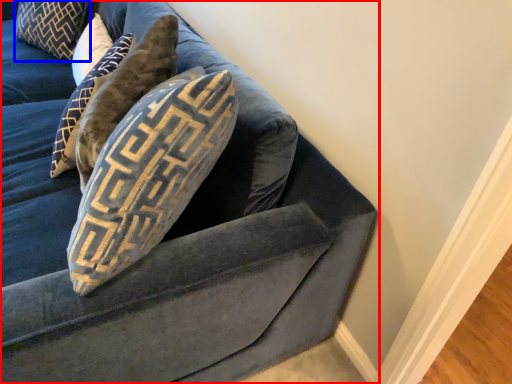
Question: Which object appears farthest to the camera in this image, studio couch (highlighted by a red box) or pillow (highlighted by a blue box)?

Choices:
 (A) studio couch
 (B) pillow

Answer: (B)